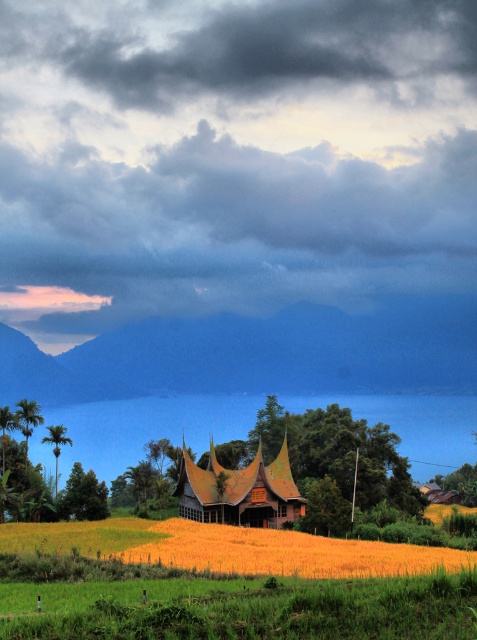
You are a photographer planning to capture the entire scene of the yellow grassy field at center and the green leafy palm tree at left in one shot. Which object will occupy more of the frame?

The yellow grassy field at center will occupy more of the frame since it is larger in size than the green leafy palm tree at left.

You are standing at the base of the hill in the rural landscape and want to reach both the point marked as point (422, 561) and the point marked as point (55, 483). Which point should you head towards first if you want to reach the one closer to you first?

You should head towards point (422, 561) first because it is closer to you than point (55, 483).